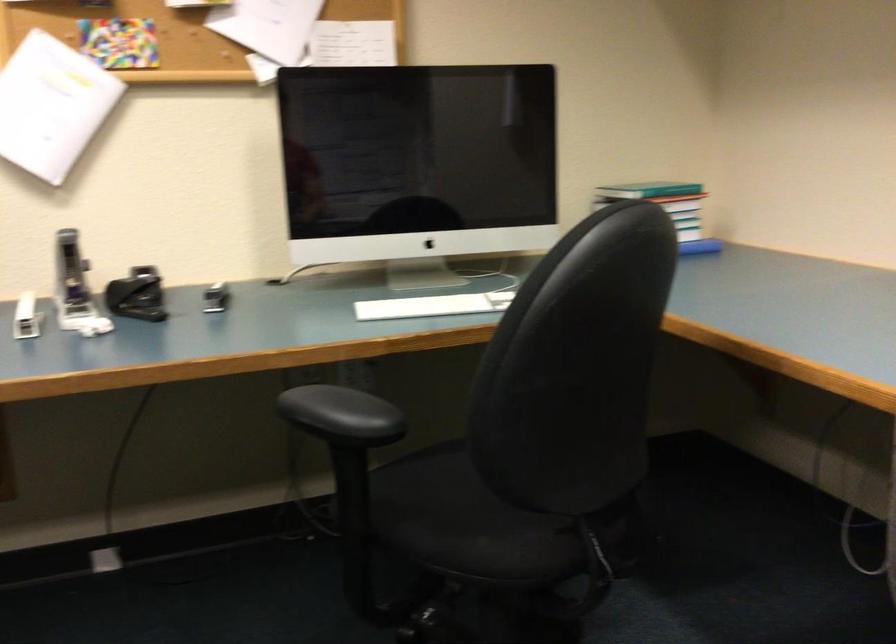
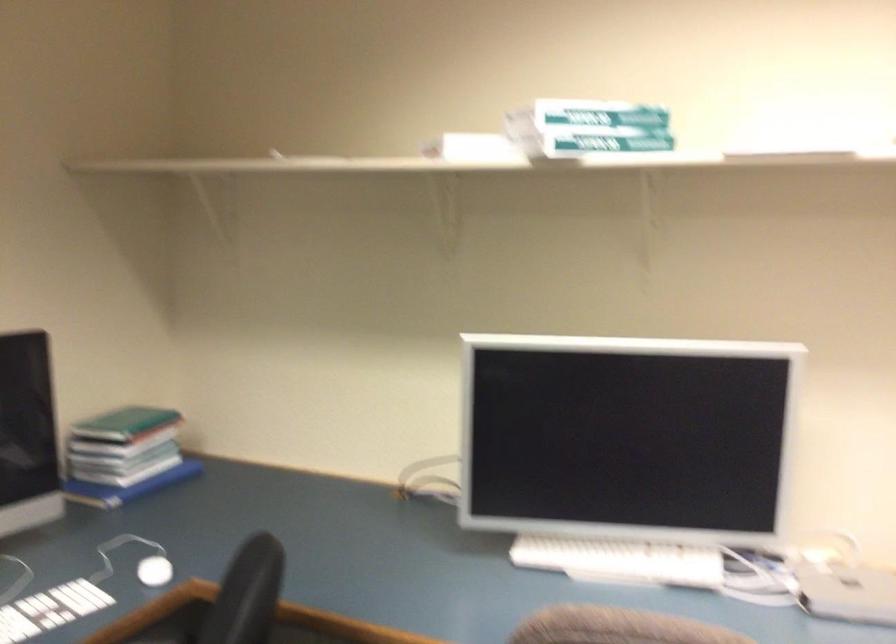
The point at (607, 185) is marked in the first image. Where is the corresponding point in the second image?

(124, 422)